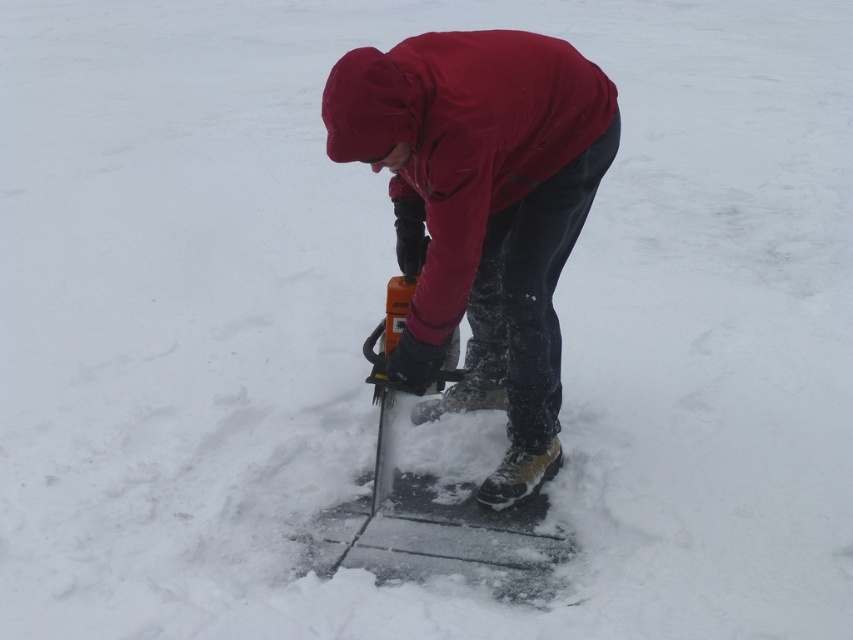
Question: Which point is closer to the camera?

Choices:
 (A) (404, 173)
 (B) (477, 557)

Answer: (A)

Question: Is matte red jacket at center bigger than orange plastic saw at center?

Choices:
 (A) no
 (B) yes

Answer: (B)

Question: Is matte red jacket at center thinner than orange plastic saw at center?

Choices:
 (A) yes
 (B) no

Answer: (A)

Question: Does matte red jacket at center appear under orange plastic saw at center?

Choices:
 (A) yes
 (B) no

Answer: (B)

Question: Among these objects, which one is farthest from the camera?

Choices:
 (A) orange plastic saw at center
 (B) matte red jacket at center

Answer: (A)